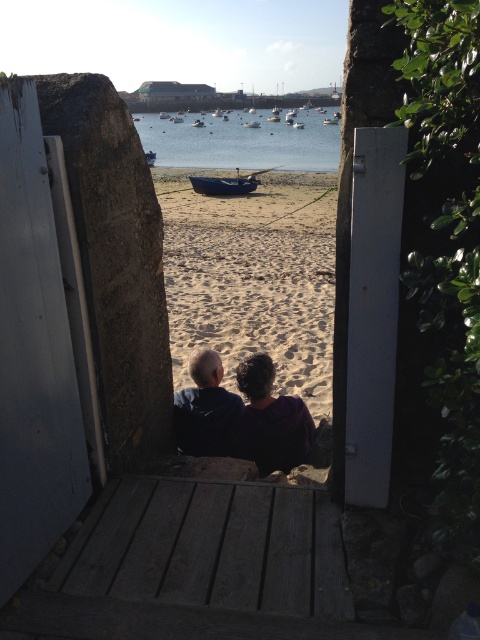
You are a guest staying at a coastal cottage and see the purple fabric at center and the white plastic boat at center from the deck. Which object is taller?

The white plastic boat at center is taller than the purple fabric at center.

From the picture: You are standing on the wooden deck and want to take a photo of both point (232, 296) and point (331, 124) in the scene. Which point should you focus on first to ensure both are in clear view?

You should focus on point (232, 296) first because it is closer to the camera than point (331, 124), allowing both points to be in clear view when focused on the closer one.

In the scene shown: You are standing on the wooden deck and want to walk to the point marked at coordinates (252, 278). Which direction should you go from the deck to reach that point?

The point marked at coordinates (252, 278) is located on the sandy beach at center, so you should walk towards the beach area in the direction away from the wooden deck and stone wall to reach it.